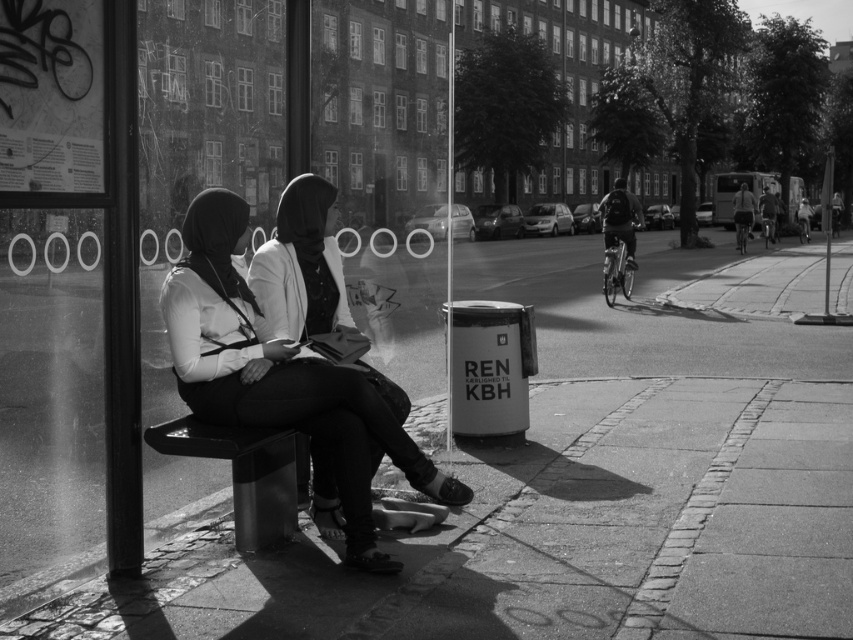
Question: Is dark fabric jacket at right bigger than dark gray fabric jacket at center right?

Choices:
 (A) no
 (B) yes

Answer: (B)

Question: Estimate the real-world distances between objects in this image. Which object is farther from the dark gray fabric jacket at center right?

Choices:
 (A) smooth leather jacket at center
 (B) light brown leather jacket at right
 (C) dark fabric jacket at right
 (D) metallic polished bench at lower left

Answer: (D)

Question: Which point is farther to the camera?

Choices:
 (A) (764, 193)
 (B) (744, 188)

Answer: (A)

Question: Is dark fabric jacket at right wider than light brown leather jacket at right?

Choices:
 (A) yes
 (B) no

Answer: (A)

Question: Which of these objects is positioned farthest from the light brown leather jacket at right?

Choices:
 (A) metallic polished bench at lower left
 (B) dark gray fabric jacket at center right
 (C) dark fabric jacket at right

Answer: (A)

Question: Where is smooth leather jacket at center located in relation to metallic polished bench at lower left in the image?

Choices:
 (A) right
 (B) left

Answer: (A)